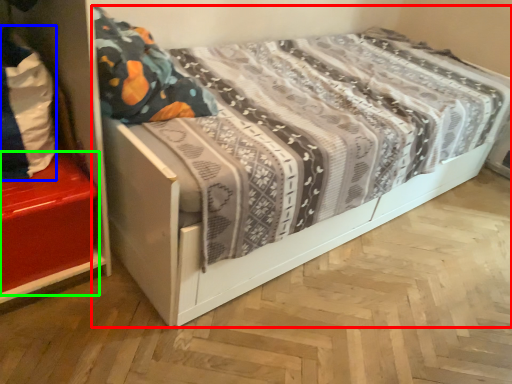
Question: Which object is positioned closest to bed (highlighted by a red box)? Select from material (highlighted by a blue box) and shelf (highlighted by a green box).

Choices:
 (A) material
 (B) shelf

Answer: (A)